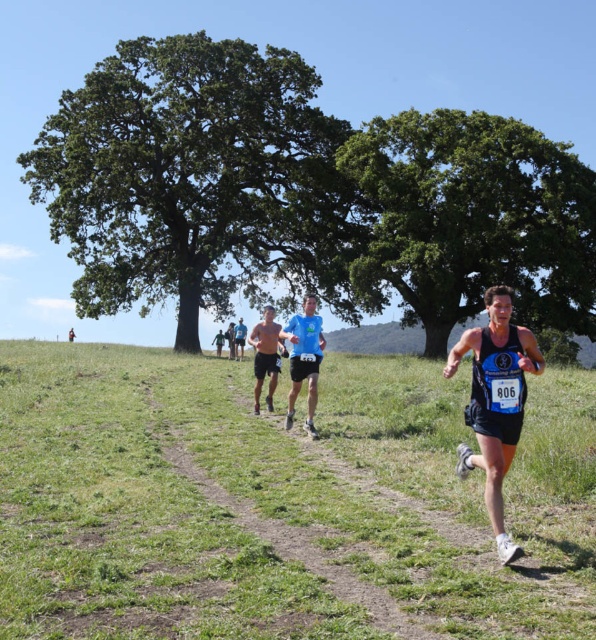
Can you confirm if matte skin running at center is wider than light brown skin at center?

Indeed, matte skin running at center has a greater width compared to light brown skin at center.

Is point (280, 324) closer to camera compared to point (213, 342)?

Yes, point (280, 324) is in front of point (213, 342).

The width and height of the screenshot is (596, 640). Identify the location of matte skin running at center. (265, 355).

The width and height of the screenshot is (596, 640). What are the coordinates of `green leafy tree at upper left` in the screenshot? It's located at (194, 179).

Looking at this image, can you confirm if green leafy tree at upper left is taller than blue fabric shirt at center?

Correct, green leafy tree at upper left is much taller as blue fabric shirt at center.

Who is more distant from viewer, [210,131] or [308,394]?

The point [210,131] is more distant.

This screenshot has height=640, width=596. In order to click on green leafy tree at upper left in this screenshot , I will do `click(194, 179)`.

Is matte skin running at center thinner than light blue fabric shirt at center?

In fact, matte skin running at center might be wider than light blue fabric shirt at center.

In order to click on matte skin running at center in this screenshot , I will do `click(265, 355)`.

At what (x,y) coordinates should I click in order to perform the action: click on matte skin running at center. Please return your answer as a coordinate pair (x, y). This screenshot has width=596, height=640. Looking at the image, I should click on (265, 355).